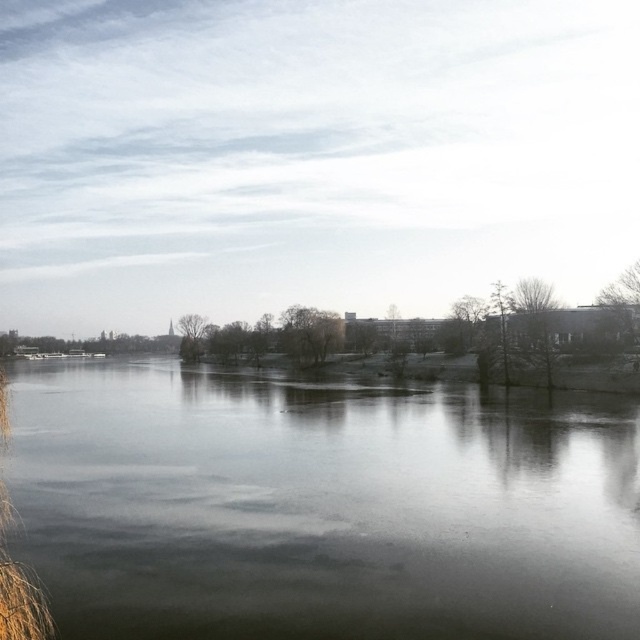
Measure the distance between dark reflective water at center and brown grass at left.

33.91 meters

Between dark reflective water at center and brown grass at left, which one is positioned lower?

dark reflective water at center is lower down.

Who is more forward, (102,397) or (1,388)?

Positioned in front is point (1,388).

You are a GUI agent. You are given a task and a screenshot of the screen. Output one action in this format:
    pyautogui.click(x=<x>, y=<y>)
    Task: Click on the dark reflective water at center
    This screenshot has height=640, width=640.
    Given the screenshot: What is the action you would take?
    pyautogui.click(x=323, y=506)